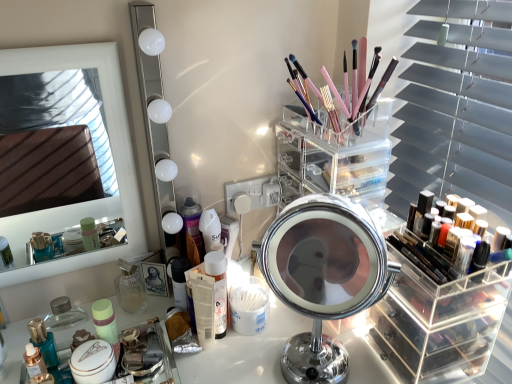
I want to click on vacant space in chrome/metallic mirror at center, marked as the third mirror in a left-to-right arrangement (from a real-world perspective), so click(324, 368).